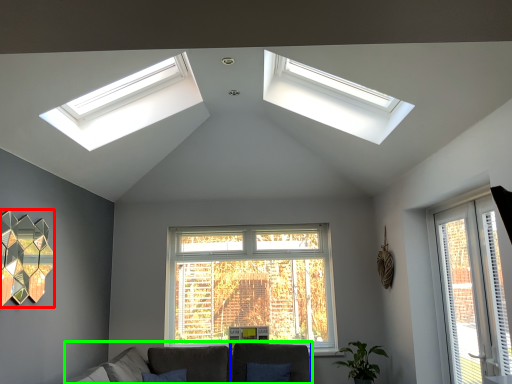
Question: Which object is positioned farthest from lamp (highlighted by a red box)? Select from armchair (highlighted by a blue box) and couch (highlighted by a green box).

Choices:
 (A) armchair
 (B) couch

Answer: (A)